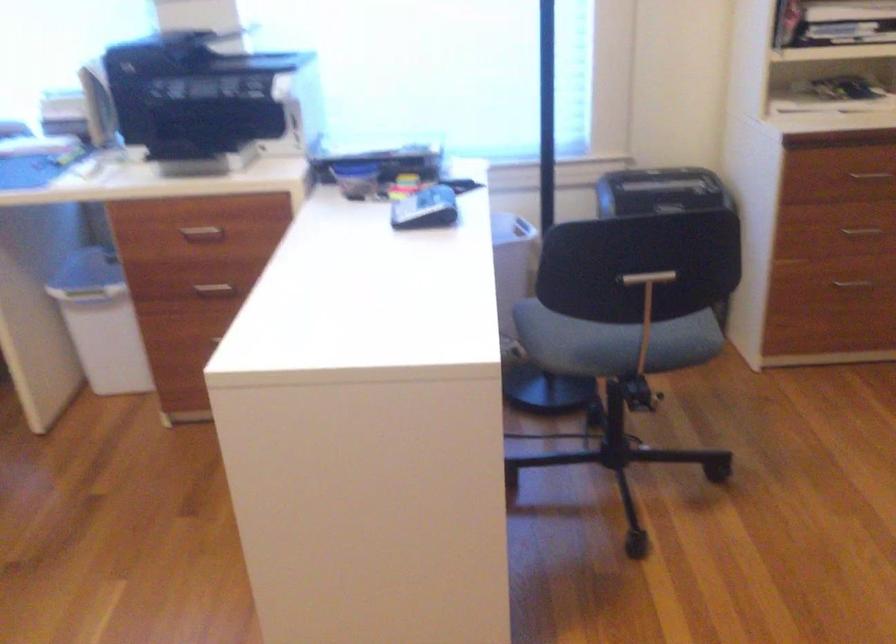
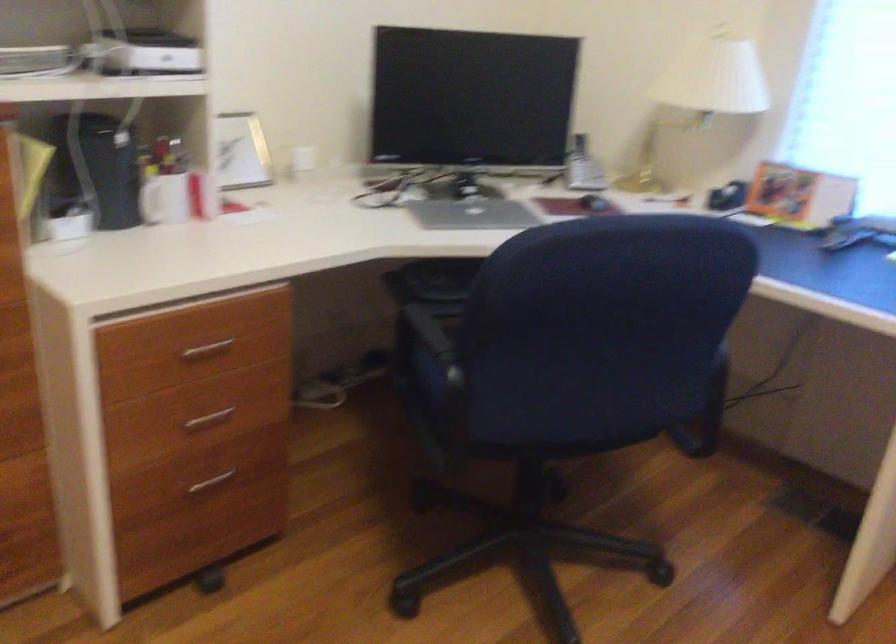
Question: The camera is either moving clockwise (left) or counter-clockwise (right) around the object. The first image is from the beginning of the video and the second image is from the end. Is the camera moving left or right when shooting the video?

Choices:
 (A) Left
 (B) Right

Answer: (B)